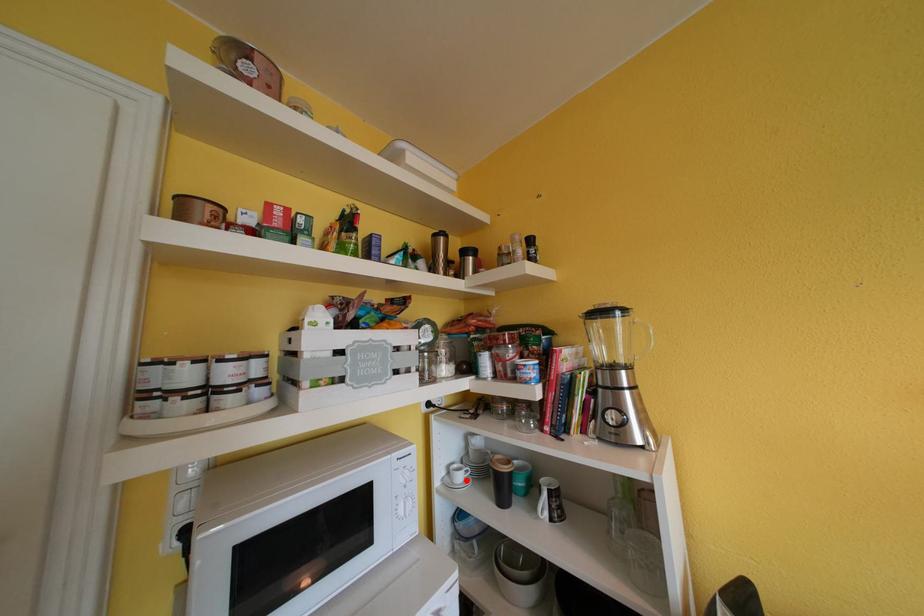
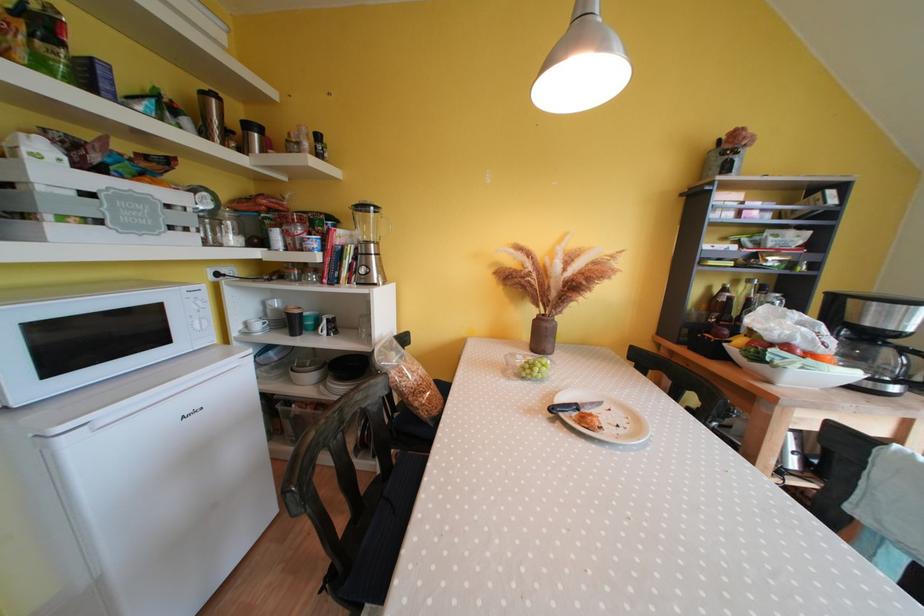
In the second image, find the point that corresponds to the highlighted location in the first image.

(264, 330)